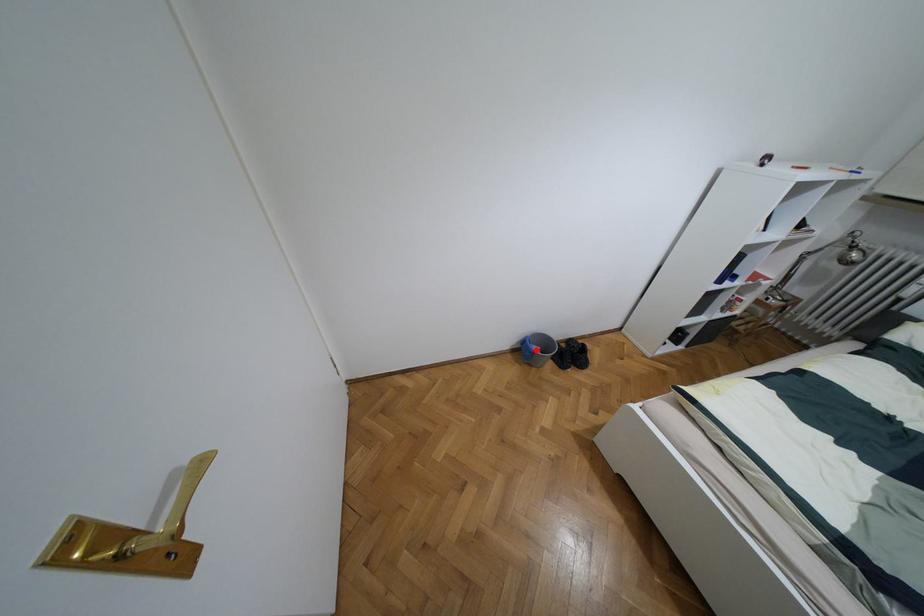
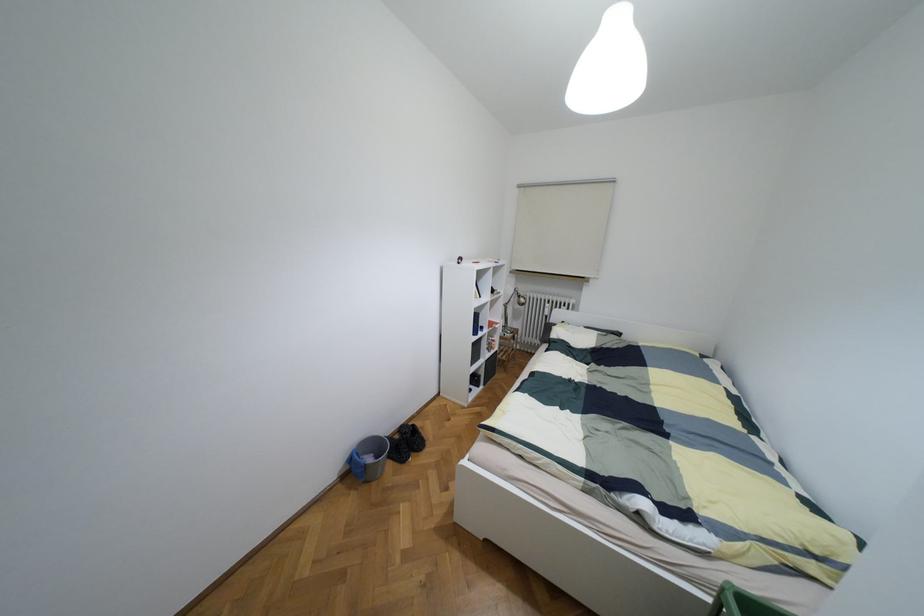
Question: A red point is marked in image1. In image2, is the corresponding 3D point closer to the camera or farther? Reply with the corresponding letter.

Choices:
 (A) The corresponding 3D point is closer.
 (B) The corresponding 3D point is farther.

Answer: (A)